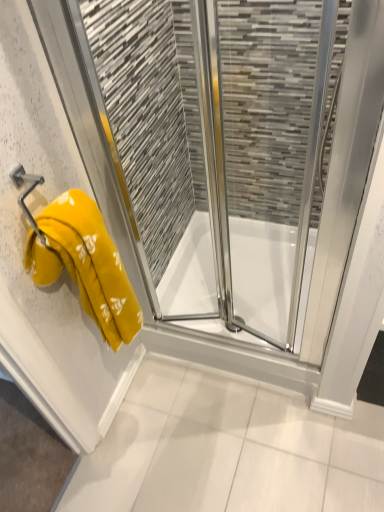
Question: Is transparent glass shower at center beside yellow towel at left?

Choices:
 (A) no
 (B) yes

Answer: (A)

Question: Considering the relative positions of transparent glass shower at center and yellow towel at left in the image provided, is transparent glass shower at center in front of yellow towel at left?

Choices:
 (A) no
 (B) yes

Answer: (A)

Question: Does transparent glass shower at center have a greater height compared to yellow towel at left?

Choices:
 (A) no
 (B) yes

Answer: (A)

Question: Are transparent glass shower at center and yellow towel at left located far from each other?

Choices:
 (A) yes
 (B) no

Answer: (B)

Question: Can you confirm if transparent glass shower at center is thinner than yellow towel at left?

Choices:
 (A) yes
 (B) no

Answer: (B)

Question: Is transparent glass shower at center positioned beyond the bounds of yellow towel at left?

Choices:
 (A) no
 (B) yes

Answer: (B)

Question: Can you confirm if transparent glass shower at center is positioned to the left of yellow fabric towel at left?

Choices:
 (A) yes
 (B) no

Answer: (B)

Question: From a real-world perspective, is transparent glass shower at center positioned under yellow fabric towel at left based on gravity?

Choices:
 (A) no
 (B) yes

Answer: (B)

Question: Does transparent glass shower at center appear on the right side of yellow fabric towel at left?

Choices:
 (A) yes
 (B) no

Answer: (A)

Question: Does transparent glass shower at center have a greater height compared to yellow fabric towel at left?

Choices:
 (A) no
 (B) yes

Answer: (A)

Question: Is yellow fabric towel at left completely or partially inside transparent glass shower at center?

Choices:
 (A) yes
 (B) no

Answer: (B)

Question: From the image's perspective, would you say transparent glass shower at center is positioned over yellow fabric towel at left?

Choices:
 (A) yes
 (B) no

Answer: (B)

Question: Can you confirm if metallic yellow towel bar at left is taller than yellow towel at left?

Choices:
 (A) no
 (B) yes

Answer: (A)